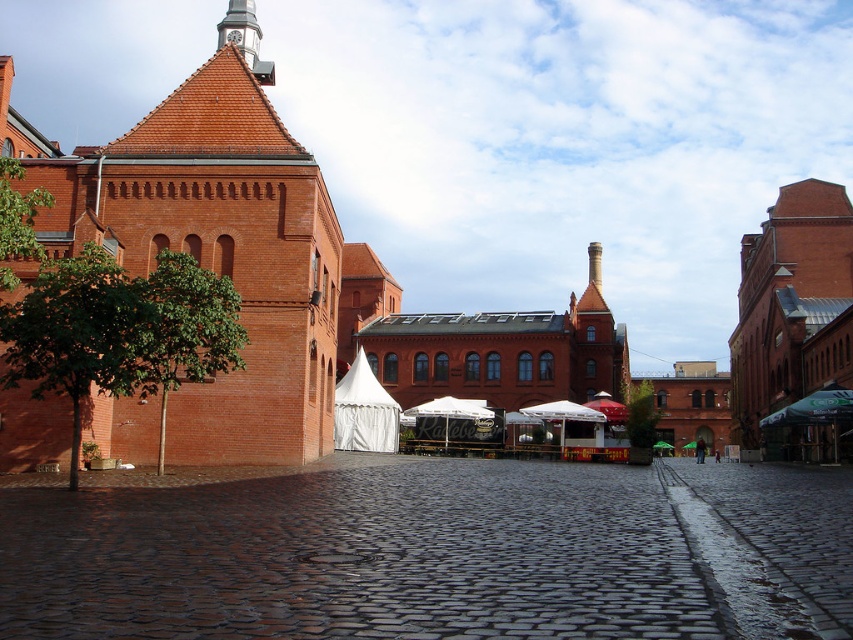
Who is more distant from viewer, (521, 541) or (345, 449)?

Point (345, 449)

Which is in front, point (257, 579) or point (351, 410)?

Point (257, 579)

The height and width of the screenshot is (640, 853). What do you see at coordinates (431, 550) in the screenshot?
I see `dark cobblestone alley at center` at bounding box center [431, 550].

Where is `dark cobblestone alley at center`? The image size is (853, 640). dark cobblestone alley at center is located at coordinates (431, 550).